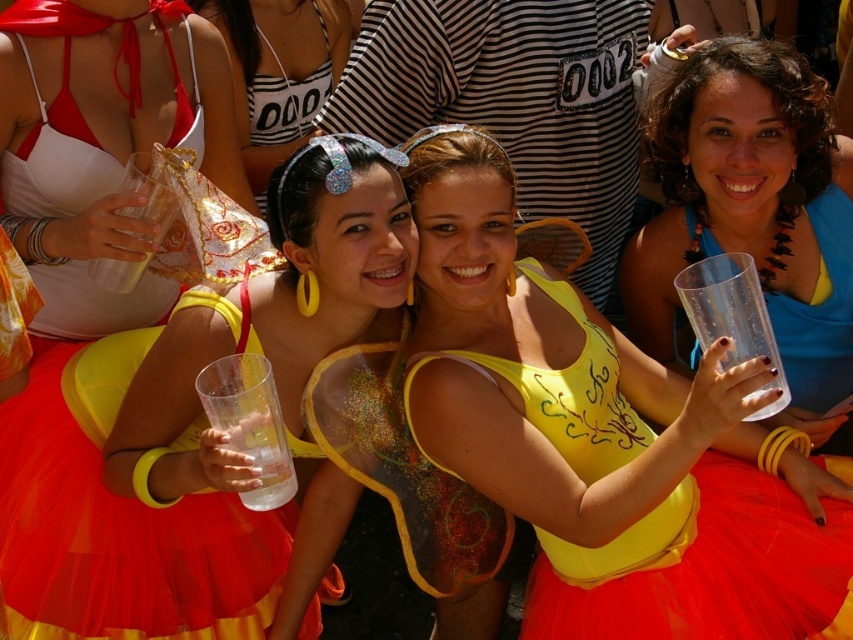
In the carnival scene, there are a matte yellow tulle dress at center and a transparent plastic cup at right. From the perspective of someone standing in front of the scene, which object is closer to you?

The matte yellow tulle dress at center is closer because the transparent plastic cup at right is behind it.

You are a photographer at the carnival and want to capture a closeup shot of the white satin bikini top at upper left and the matte plastic cup at upper center. Since you can only focus on one object at a time, which object should you choose to ensure the other is still in the frame?

The white satin bikini top at upper left is narrower than the matte plastic cup at upper center. Therefore, focusing on the wider matte plastic cup at upper center would still keep the smaller white satin bikini top at upper left within the frame.

You are a photographer setting up for a group photo at a carnival. You have to position a matte yellow tulle dress at center and a transparent plastic cup at right in your frame. Based on the scene, which object should you focus on first if you want to ensure both are in focus?

The matte yellow tulle dress at center is much taller than the transparent plastic cup at right, so focusing on the taller object first would help ensure both are in focus.